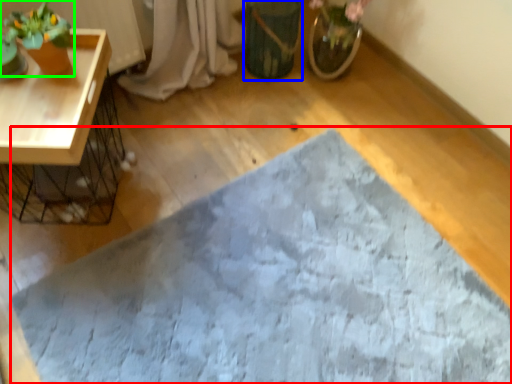
Question: Which object is the closest to the bath mat (highlighted by a red box)? Choose among these: flowerpot (highlighted by a blue box) or houseplant (highlighted by a green box).

Choices:
 (A) flowerpot
 (B) houseplant

Answer: (A)